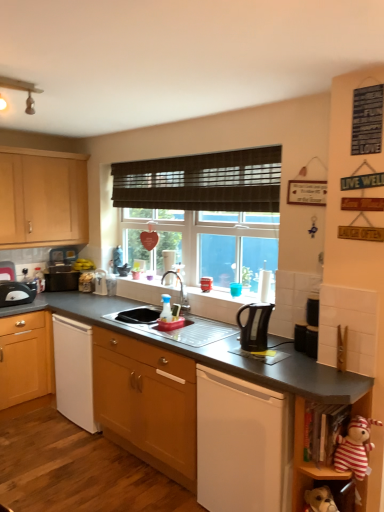
I want to click on vacant area that lies in front of black plastic kettle at center, which ranks as the first kitchen appliance in front-to-back order, so click(266, 359).